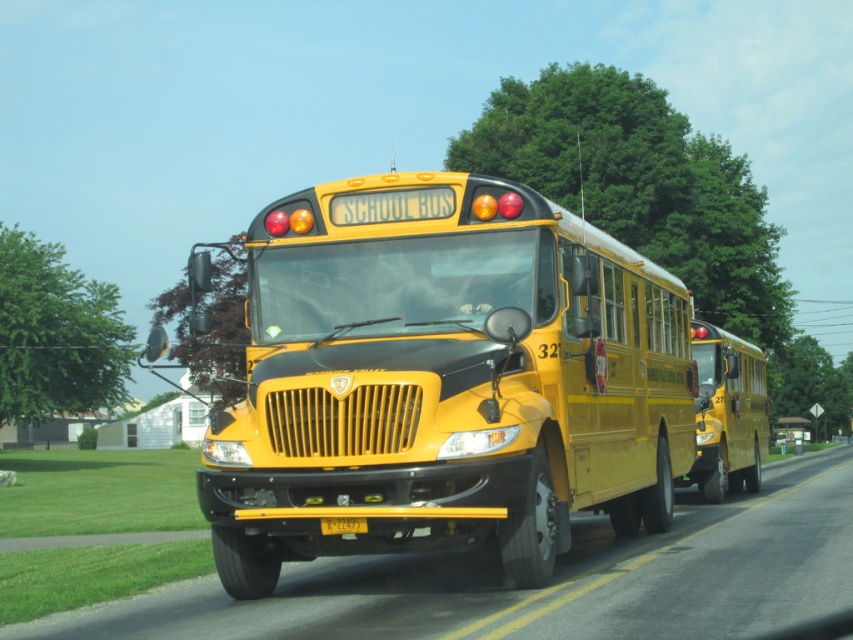
Between yellow matte/solid school bus at center and yellow matte license plate at center, which one appears on the right side from the viewer's perspective?

Positioned to the right is yellow matte/solid school bus at center.

Does yellow matte/solid school bus at center lie behind yellow matte license plate at center?

No, it is not.

I want to click on yellow matte/solid school bus at center, so click(x=440, y=378).

Image resolution: width=853 pixels, height=640 pixels. In order to click on yellow matte/solid school bus at center in this screenshot , I will do `click(440, 378)`.

Who is more forward, (526, 467) or (509, 618)?

Positioned in front is point (509, 618).

Is yellow matte/solid school bus at center smaller than yellow matte school bus at center?

Correct, yellow matte/solid school bus at center occupies less space than yellow matte school bus at center.

You are a GUI agent. You are given a task and a screenshot of the screen. Output one action in this format:
    pyautogui.click(x=<x>, y=<y>)
    Task: Click on the yellow matte/solid school bus at center
    This screenshot has height=640, width=853.
    Given the screenshot: What is the action you would take?
    pyautogui.click(x=440, y=378)

Is yellow matte school bus at center shorter than yellow matte license plate at center?

No.

Is yellow matte school bus at center to the right of yellow matte license plate at center from the viewer's perspective?

Yes, yellow matte school bus at center is to the right of yellow matte license plate at center.

At what (x,y) coordinates should I click in order to perform the action: click on yellow matte school bus at center. Please return your answer as a coordinate pair (x, y). Looking at the image, I should click on (610, 572).

Identify the location of yellow matte school bus at center. The height and width of the screenshot is (640, 853). (610, 572).